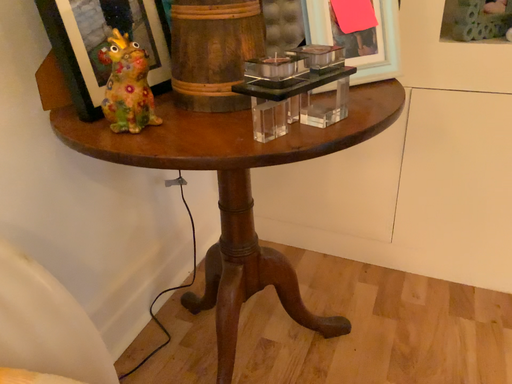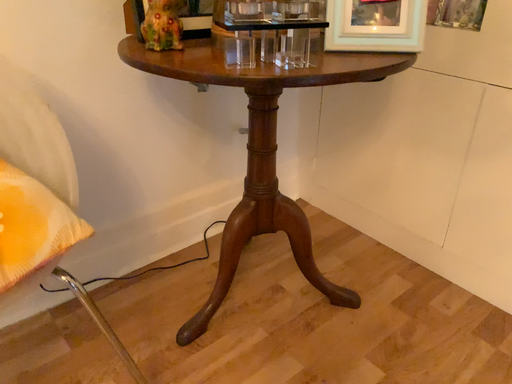
Question: Which way did the camera rotate in the video?

Choices:
 (A) rotated left
 (B) rotated right

Answer: (A)